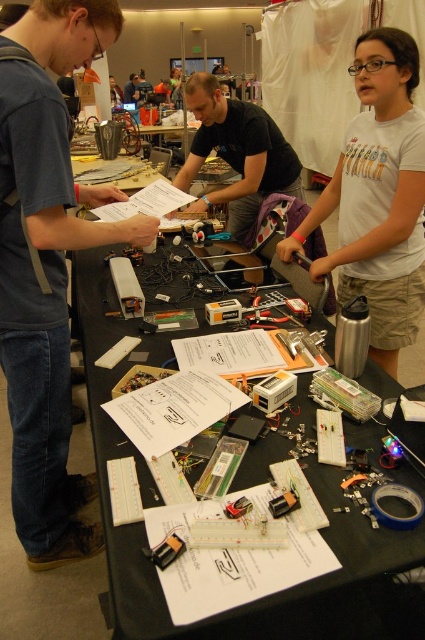
Who is positioned more to the right, white cotton shirt at upper center or black matte shirt at center?

Positioned to the right is white cotton shirt at upper center.

Between point (342, 186) and point (286, 166), which one is positioned behind?

The point (286, 166) is more distant.

Where is `white cotton shirt at upper center`? The image size is (425, 640). white cotton shirt at upper center is located at coordinates (377, 196).

Does point (416, 289) come in front of point (142, 84)?

That is True.

Image resolution: width=425 pixels, height=640 pixels. I want to click on white cotton shirt at upper center, so pos(377,196).

Measure the distance from black matte shirt at center to matte black shirt at center.

They are 8.02 meters apart.

Between point (291, 160) and point (136, 99), which one is positioned in front?

Point (291, 160) is more forward.

This screenshot has width=425, height=640. What do you see at coordinates (237, 154) in the screenshot?
I see `black matte shirt at center` at bounding box center [237, 154].

This screenshot has height=640, width=425. I want to click on black matte shirt at center, so (x=237, y=154).